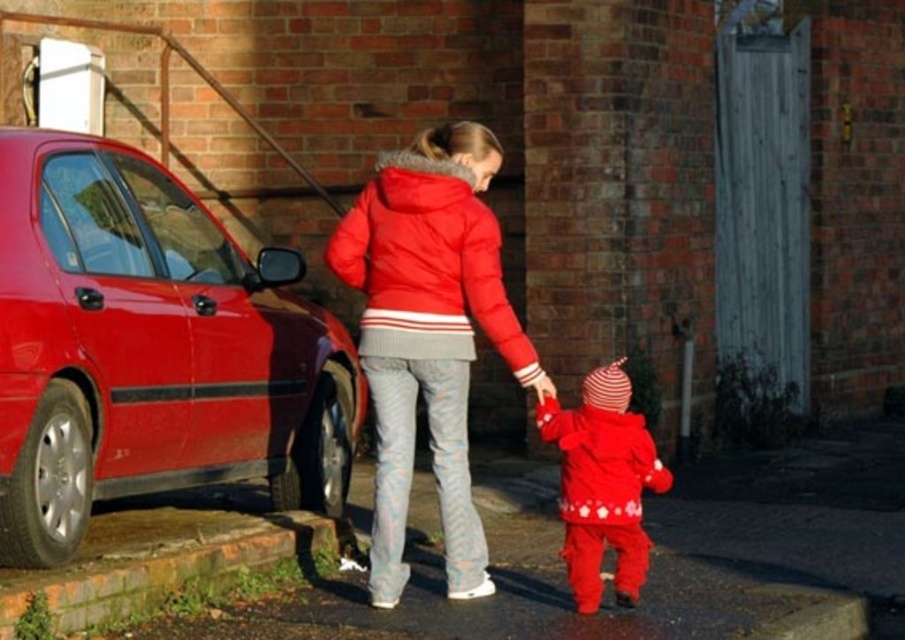
Question: Which object is positioned closest to the shiny red car at left?

Choices:
 (A) matte red puffer jacket at center
 (B) puffy red jacket at center
 (C) matte red snowsuit at center

Answer: (B)

Question: Based on their relative distances, which object is farther from the matte red snowsuit at center?

Choices:
 (A) matte red puffer jacket at center
 (B) shiny red car at left

Answer: (B)

Question: Does shiny red car at left appear under matte red puffer jacket at center?

Choices:
 (A) no
 (B) yes

Answer: (B)

Question: Which object is closer to the camera taking this photo?

Choices:
 (A) matte red snowsuit at center
 (B) puffy red jacket at center
 (C) shiny red car at left

Answer: (C)

Question: Does shiny red car at left appear on the left side of matte red snowsuit at center?

Choices:
 (A) yes
 (B) no

Answer: (A)

Question: Does puffy red jacket at center appear on the right side of matte red snowsuit at center?

Choices:
 (A) yes
 (B) no

Answer: (B)